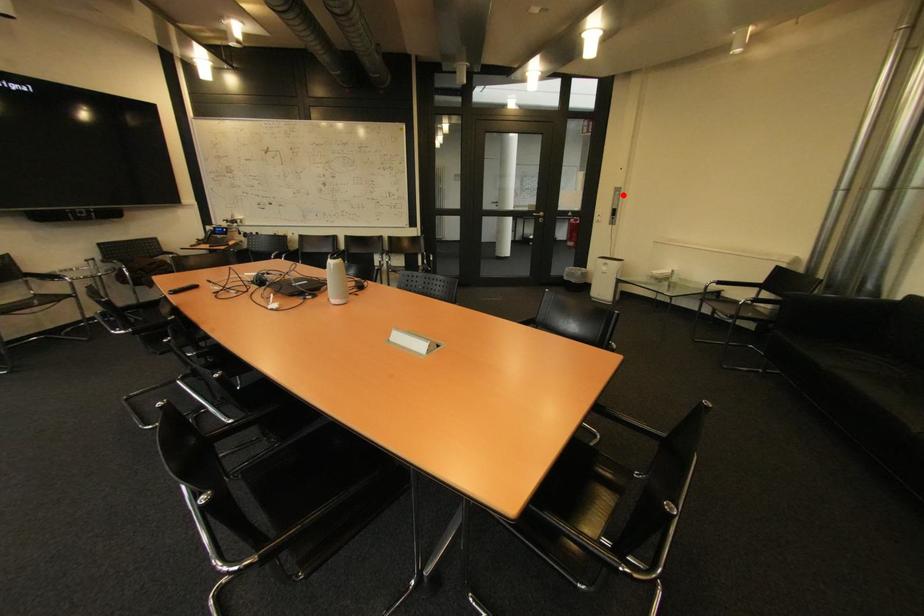
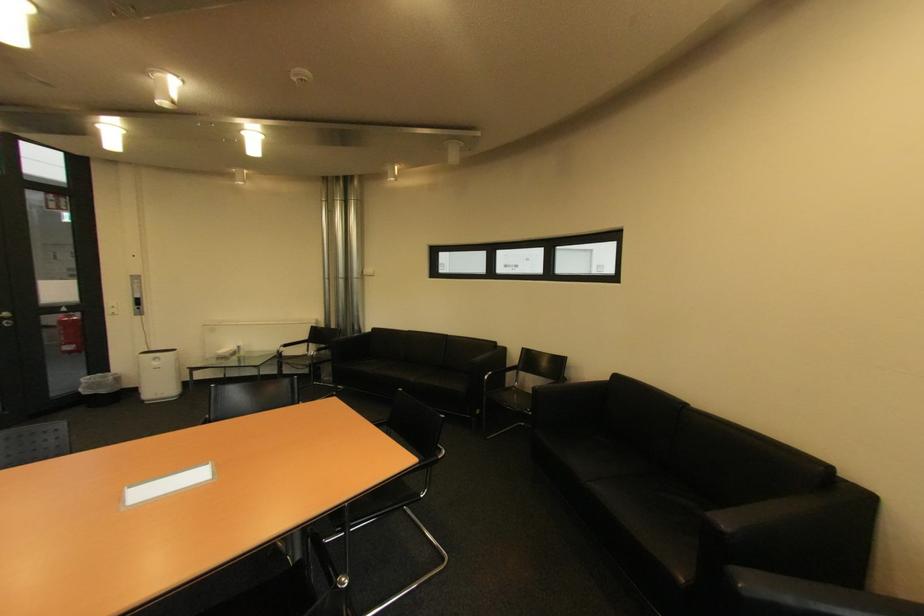
Locate, in the second image, the point that corresponds to the highlighted location in the first image.

(140, 283)